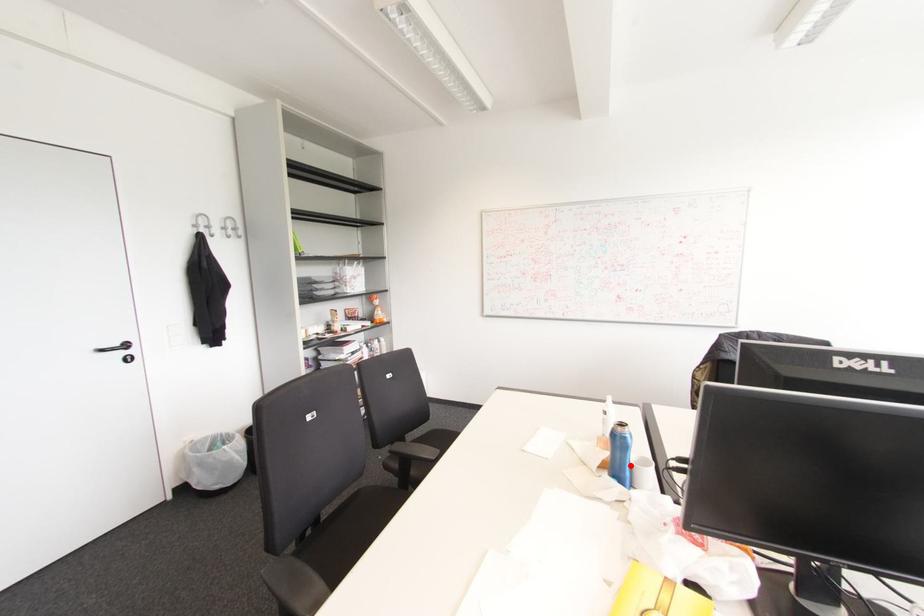
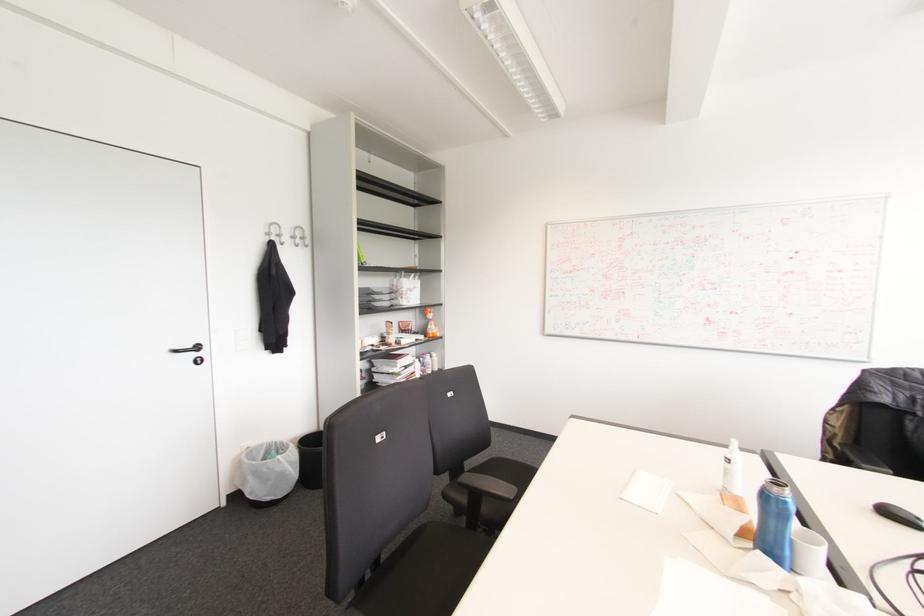
Find the pixel in the second image that matches the highlighted location in the first image.

(792, 541)